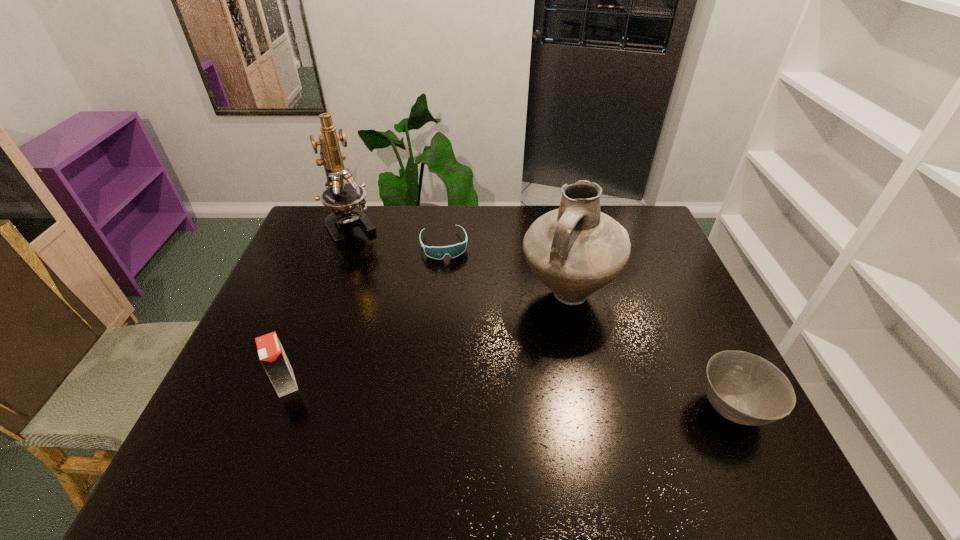
The image size is (960, 540). What are the coordinates of `microscope located at the far edge` in the screenshot? It's located at (342, 198).

This screenshot has width=960, height=540. Find the location of `object present at the near edge`. object present at the near edge is located at coordinates (744, 388).

You are a GUI agent. You are given a task and a screenshot of the screen. Output one action in this format:
    pyautogui.click(x=<x>, y=<y>)
    Task: Click on the orange juice located at the left edge
    The width and height of the screenshot is (960, 540).
    Given the screenshot: What is the action you would take?
    pyautogui.click(x=272, y=356)

Where is `microscope situated at the left edge`? The height and width of the screenshot is (540, 960). microscope situated at the left edge is located at coordinates pos(342,198).

Where is `object present at the right edge`? object present at the right edge is located at coordinates (744, 388).

Image resolution: width=960 pixels, height=540 pixels. Identify the location of object that is at the far left corner. [342, 198].

Where is `object present at the near right corner`? This screenshot has width=960, height=540. object present at the near right corner is located at coordinates (744, 388).

Where is `free region at the far edge`? The width and height of the screenshot is (960, 540). free region at the far edge is located at coordinates (457, 229).

At what (x,y) coordinates should I click in order to perform the action: click on vacant area at the near edge of the desktop. Please return your answer as a coordinate pair (x, y). The height and width of the screenshot is (540, 960). Looking at the image, I should click on (575, 402).

Where is `vacant space at the left edge of the desktop`? The height and width of the screenshot is (540, 960). vacant space at the left edge of the desktop is located at coordinates (300, 295).